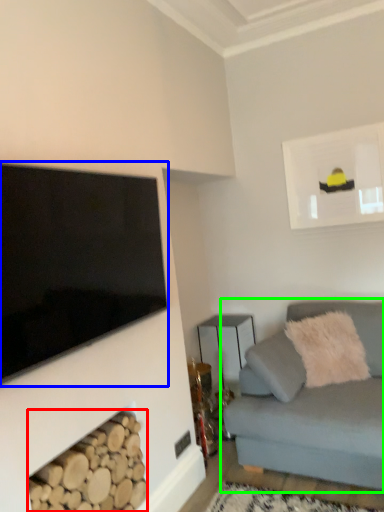
Question: Based on their relative distances, which object is farther from wood (highlighted by a red box)? Choose from television (highlighted by a blue box) and studio couch (highlighted by a green box).

Choices:
 (A) television
 (B) studio couch

Answer: (B)